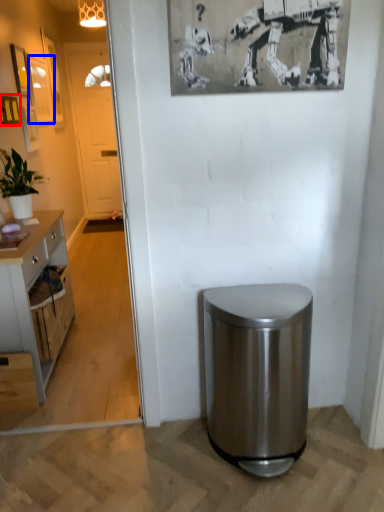
Question: Which object is further to the camera taking this photo, picture frame (highlighted by a red box) or picture frame (highlighted by a blue box)?

Choices:
 (A) picture frame
 (B) picture frame

Answer: (B)